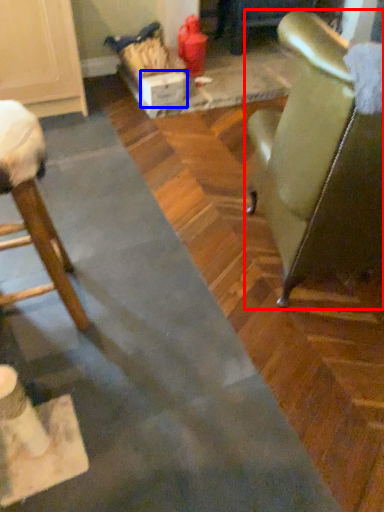
Question: Among these objects, which one is nearest to the camera, chair (highlighted by a red box) or cardboard box (highlighted by a blue box)?

Choices:
 (A) chair
 (B) cardboard box

Answer: (A)